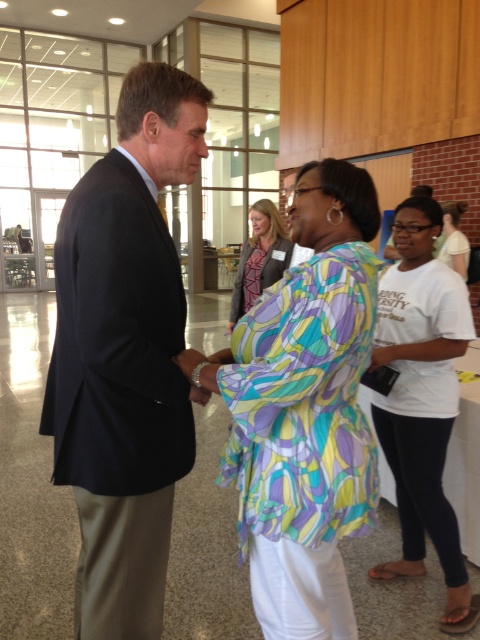
Can you confirm if printed fabric blouse at center is shorter than white cotton shirt at upper right?

In fact, printed fabric blouse at center may be taller than white cotton shirt at upper right.

Does point (260, 257) come farther from viewer compared to point (464, 234)?

No, it is in front of (464, 234).

Identify the location of printed fabric blouse at center. (260, 259).

Can you confirm if black suit at left is positioned to the left of white cotton t-shirt at right?

Correct, you'll find black suit at left to the left of white cotton t-shirt at right.

Does black suit at left have a greater height compared to white cotton t-shirt at right?

Incorrect, black suit at left's height is not larger of white cotton t-shirt at right's.

What do you see at coordinates (124, 355) in the screenshot? I see `black suit at left` at bounding box center [124, 355].

At what (x,y) coordinates should I click in order to perform the action: click on black suit at left. Please return your answer as a coordinate pair (x, y). Image resolution: width=480 pixels, height=640 pixels. Looking at the image, I should click on (124, 355).

Is point (344, 164) farther from viewer compared to point (431, 380)?

No, (344, 164) is in front of (431, 380).

What do you see at coordinates (303, 410) in the screenshot? I see `multicolored fabric blouse at center` at bounding box center [303, 410].

Is point (231, 465) behind point (373, 362)?

No.

Find the location of a particular element. This screenshot has width=480, height=640. multicolored fabric blouse at center is located at coordinates (303, 410).